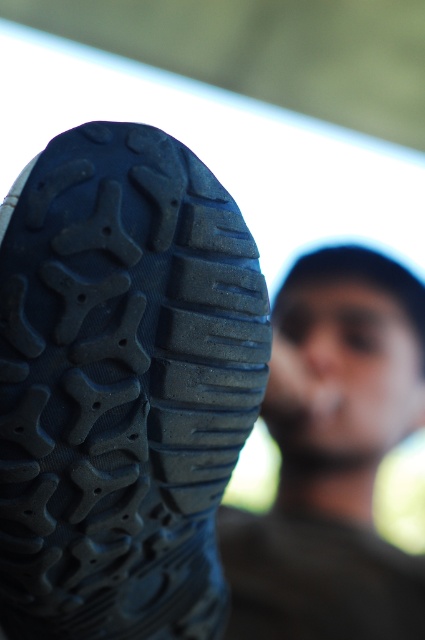
Question: Can you confirm if black rubber shoe at lower left is positioned above dark brown leather shoe at lower left?

Choices:
 (A) yes
 (B) no

Answer: (A)

Question: Is black rubber shoe at lower left to the right of dark brown leather shoe at lower left from the viewer's perspective?

Choices:
 (A) yes
 (B) no

Answer: (B)

Question: Which object is farther from the camera taking this photo?

Choices:
 (A) black rubber shoe at lower left
 (B) dark brown leather shoe at lower left

Answer: (B)

Question: Can you confirm if black rubber shoe at lower left is smaller than dark brown leather shoe at lower left?

Choices:
 (A) yes
 (B) no

Answer: (A)